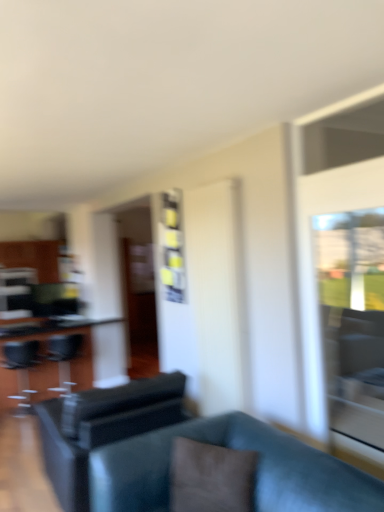
Question: From a real-world perspective, is brown fabric pillow at center above or below black glass table at left?

Choices:
 (A) below
 (B) above

Answer: (B)

Question: Is brown fabric pillow at center in front of or behind black glass table at left in the image?

Choices:
 (A) front
 (B) behind

Answer: (A)

Question: Which of these objects is positioned farthest from the black leather swivel chair at left, arranged as the 3th swivel chair when viewed from the right?

Choices:
 (A) black leather swivel chair at center, acting as the third swivel chair starting from the back
 (B) brown fabric pillow at center
 (C) black glass table at left
 (D) leather couch at center
 (E) matte black swivel chair at left, which is the second swivel chair in left-to-right order

Answer: (B)

Question: Estimate the real-world distances between objects in this image. Which object is closer to the black leather swivel chair at center, acting as the third swivel chair starting from the back?

Choices:
 (A) transparent glass door at right
 (B) black leather swivel chair at left, marked as the 1th swivel chair in a left-to-right arrangement
 (C) leather couch at center
 (D) brown fabric pillow at center
 (E) black glass table at left

Answer: (C)